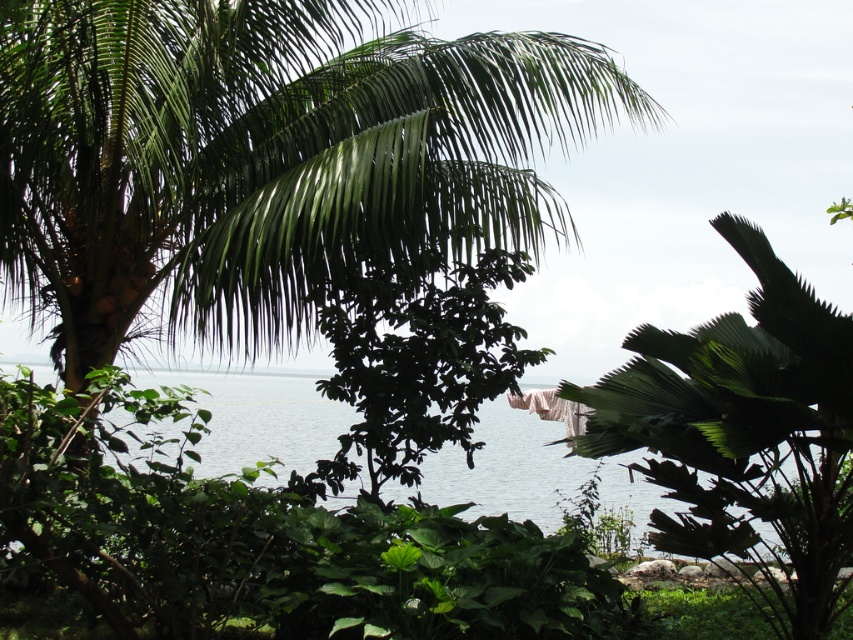
You are standing on the beach and want to take a photo of the green leafy coconut tree at upper left and the clear blue water at center. Which object should you focus on first to ensure both are in focus?

You should focus on the green leafy coconut tree at upper left first because it is closer to the viewer than the clear blue water at center. By focusing on the closer object, the background object may still be in focus depending on the depth of field.

You are standing on a beach and see the green leafy coconut tree at upper left and the clear blue water at center. Which object is positioned to the left of the other?

The green leafy coconut tree at upper left is to the left of clear blue water at center.

You are standing in the coastal scene described. You see a point marked at coordinates (264, 157). What object is located at this point?

The point at coordinates (264, 157) indicates the green leafy coconut tree at upper left.